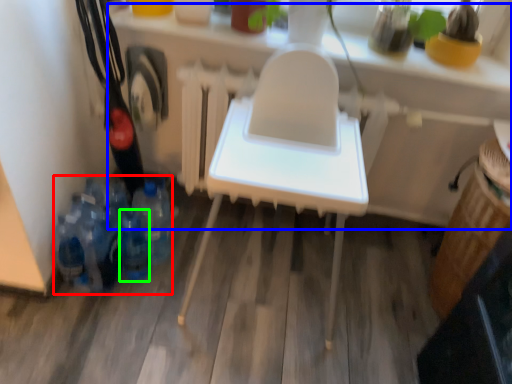
Question: Estimate the real-world distances between objects in this image. Which object is farther from bottle (highlighted by a red box), table (highlighted by a blue box) or bottle (highlighted by a green box)?

Choices:
 (A) table
 (B) bottle

Answer: (A)